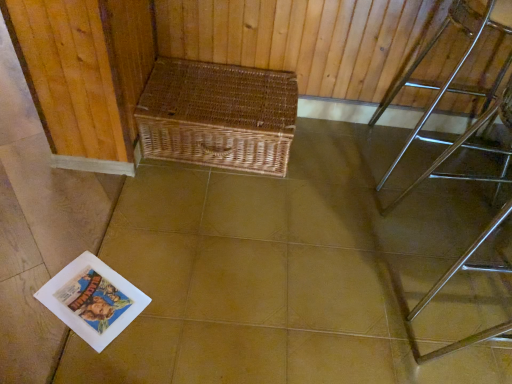
Question: From a real-world perspective, is woven brown picnic basket at center physically located above or below polished chrome table at right?

Choices:
 (A) above
 (B) below

Answer: (B)

Question: From the image's perspective, is woven brown picnic basket at center above or below polished chrome table at right?

Choices:
 (A) below
 (B) above

Answer: (A)

Question: Estimate the real-world distances between objects in this image. Which object is farther from the polished chrome table at right?

Choices:
 (A) woven brown picnic basket at center
 (B) woven wicker basket at upper center

Answer: (A)

Question: Which of these objects is positioned closest to the woven wicker basket at upper center?

Choices:
 (A) polished chrome table at right
 (B) woven brown picnic basket at center

Answer: (B)